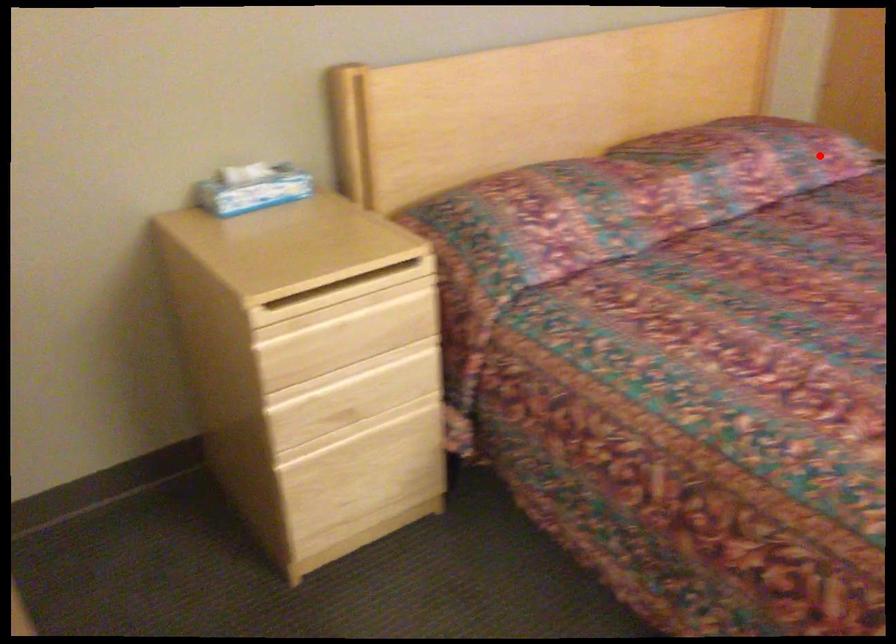
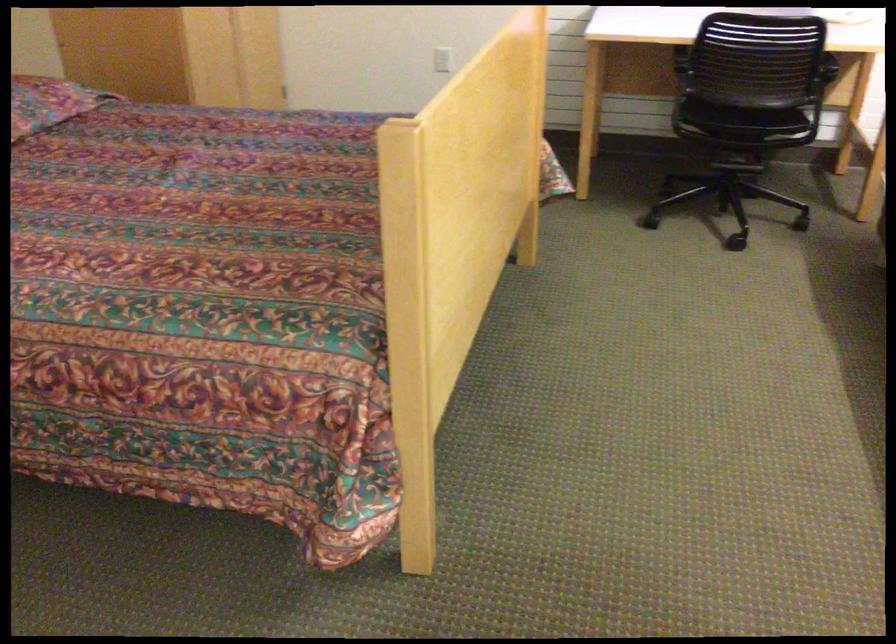
Question: I am providing you with two images of the same scene from different viewpoints. Given a red point in image1, look at the same physical point in image2. Is it:

Choices:
 (A) Closer to the viewpoint
 (B) Farther from the viewpoint

Answer: (B)